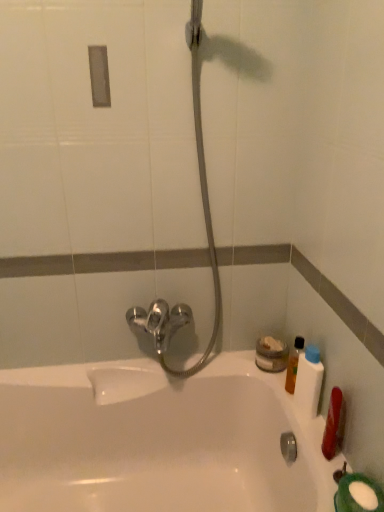
Where is `translucent plastic bottle at right, which appears as the 1th mouthwash when viewed from the back`? Image resolution: width=384 pixels, height=512 pixels. translucent plastic bottle at right, which appears as the 1th mouthwash when viewed from the back is located at coordinates (293, 364).

At what (x,y) coordinates should I click in order to perform the action: click on translucent plastic bottle at right, marked as the 2th mouthwash in a front-to-back arrangement. Please return your answer as a coordinate pair (x, y). The image size is (384, 512). Looking at the image, I should click on (293, 364).

How far apart are translucent plastic bottle at right, marked as the 2th mouthwash in a front-to-back arrangement, and white plastic bottle at right, the second mouthwash from the back?

They are 3.36 inches apart.

Is translucent plastic bottle at right, which appears as the 1th mouthwash when viewed from the back, closer to the viewer compared to white plastic bottle at right, arranged as the 1th mouthwash when viewed from the front?

That is False.

From the image's perspective, is translucent plastic bottle at right, which appears as the 1th mouthwash when viewed from the back, under white plastic bottle at right, arranged as the 1th mouthwash when viewed from the front?

No.

Which is in front, point (290, 390) or point (316, 399)?

Positioned in front is point (316, 399).

Is the surface of white plastic bottle at right, the second mouthwash from the back, in direct contact with white glossy bathtub at center?

white plastic bottle at right, the second mouthwash from the back, and white glossy bathtub at center are clearly separated.

Where is `bathtub located on the left of white plastic bottle at right, arranged as the 1th mouthwash when viewed from the front`? This screenshot has height=512, width=384. bathtub located on the left of white plastic bottle at right, arranged as the 1th mouthwash when viewed from the front is located at coordinates (157, 440).

Which of these two, white plastic bottle at right, arranged as the 1th mouthwash when viewed from the front, or white glossy bathtub at center, is wider?

white glossy bathtub at center.

Is white plastic bottle at right, arranged as the 1th mouthwash when viewed from the front, closer to the viewer compared to white glossy bathtub at center?

That is False.

Is white glossy bathtub at center not inside white plastic bottle at right, the second mouthwash from the back?

Yes, white glossy bathtub at center is not within white plastic bottle at right, the second mouthwash from the back.

From the image's perspective, which object appears higher, white glossy bathtub at center or white plastic bottle at right, arranged as the 1th mouthwash when viewed from the front?

white plastic bottle at right, arranged as the 1th mouthwash when viewed from the front, appears higher in the image.

Is point (73, 505) closer or farther from the camera than point (314, 412)?

Point (73, 505).

Which object is closer to the camera, white glossy bathtub at center or white plastic bottle at right, the second mouthwash from the back?

white glossy bathtub at center is more forward.

Find the location of a particular element. shower located above the white plastic bottle at right, the second mouthwash from the back (from a real-world perspective) is located at coordinates (206, 232).

Does white plastic bottle at right, the second mouthwash from the back, appear on the right side of satin nickel faucet at center?

Yes, white plastic bottle at right, the second mouthwash from the back, is to the right of satin nickel faucet at center.

Does white plastic bottle at right, the second mouthwash from the back, have a greater width compared to satin nickel faucet at center?

Incorrect, the width of white plastic bottle at right, the second mouthwash from the back, does not surpass that of satin nickel faucet at center.

From the image's perspective, is white plastic bottle at right, arranged as the 1th mouthwash when viewed from the front, below satin nickel faucet at center?

Indeed, from the image's perspective, white plastic bottle at right, arranged as the 1th mouthwash when viewed from the front, is shown beneath satin nickel faucet at center.

From a real-world perspective, does translucent plastic bottle at right, which appears as the 1th mouthwash when viewed from the back, stand above satin nickel faucet at center?

No.

Based on their positions, is translucent plastic bottle at right, marked as the 2th mouthwash in a front-to-back arrangement, located to the left or right of satin nickel faucet at center?

From the image, it's evident that translucent plastic bottle at right, marked as the 2th mouthwash in a front-to-back arrangement, is to the right of satin nickel faucet at center.

Is translucent plastic bottle at right, which appears as the 1th mouthwash when viewed from the back, placed right next to satin nickel faucet at center?

No, translucent plastic bottle at right, which appears as the 1th mouthwash when viewed from the back, is not beside satin nickel faucet at center.

From the image's perspective, which is below, translucent plastic bottle at right, marked as the 2th mouthwash in a front-to-back arrangement, or satin nickel faucet at center?

From the image's view, translucent plastic bottle at right, marked as the 2th mouthwash in a front-to-back arrangement, is below.

Between satin nickel faucet at center and white plastic bottle at right, arranged as the 1th mouthwash when viewed from the front, which one appears on the right side from the viewer's perspective?

From the viewer's perspective, white plastic bottle at right, arranged as the 1th mouthwash when viewed from the front, appears more on the right side.

Which of these two, satin nickel faucet at center or white plastic bottle at right, the second mouthwash from the back, is smaller?

white plastic bottle at right, the second mouthwash from the back.

From a real-world perspective, relative to white glossy bathtub at center, is translucent plastic bottle at right, which appears as the 1th mouthwash when viewed from the back, vertically above or below?

Clearly, from a real-world perspective, translucent plastic bottle at right, which appears as the 1th mouthwash when viewed from the back, is above white glossy bathtub at center.

Considering the sizes of translucent plastic bottle at right, which appears as the 1th mouthwash when viewed from the back, and white glossy bathtub at center in the image, is translucent plastic bottle at right, which appears as the 1th mouthwash when viewed from the back, wider or thinner than white glossy bathtub at center?

In the image, translucent plastic bottle at right, which appears as the 1th mouthwash when viewed from the back, appears to be more narrow than white glossy bathtub at center.

In terms of height, does translucent plastic bottle at right, which appears as the 1th mouthwash when viewed from the back, look taller or shorter compared to white glossy bathtub at center?

In the image, translucent plastic bottle at right, which appears as the 1th mouthwash when viewed from the back, appears to be shorter than white glossy bathtub at center.

Based on the photo, which is in front, translucent plastic bottle at right, marked as the 2th mouthwash in a front-to-back arrangement, or white glossy bathtub at center?

white glossy bathtub at center is closer to the camera.

The width and height of the screenshot is (384, 512). In the image, there is a white plastic bottle at right, the second mouthwash from the back. What are the coordinates of `mouthwash below it (from a real-world perspective)` in the screenshot? It's located at (293, 364).

The width and height of the screenshot is (384, 512). Find the location of `the 2nd mouthwash counting from the right of the white glossy bathtub at center`. the 2nd mouthwash counting from the right of the white glossy bathtub at center is located at coordinates (309, 381).

Looking at the image, which one is located further to translucent plastic bottle at right, which appears as the 1th mouthwash when viewed from the back, white glossy bathtub at center or white plastic bottle at right, arranged as the 1th mouthwash when viewed from the front?

Based on the image, white glossy bathtub at center appears to be further to translucent plastic bottle at right, which appears as the 1th mouthwash when viewed from the back.

Estimate the real-world distances between objects in this image. Which object is closer to white plastic bottle at right, the second mouthwash from the back, satin nickel faucet at center or white glossy bathtub at center?

satin nickel faucet at center lies closer to white plastic bottle at right, the second mouthwash from the back, than the other object.

When comparing their distances from white plastic bottle at right, the second mouthwash from the back, does satin nickel faucet at center or translucent plastic bottle at right, marked as the 2th mouthwash in a front-to-back arrangement, seem closer?

translucent plastic bottle at right, marked as the 2th mouthwash in a front-to-back arrangement, is positioned closer to the anchor white plastic bottle at right, the second mouthwash from the back.

When comparing their distances from satin nickel faucet at center, does white glossy bathtub at center or white plastic bottle at right, the second mouthwash from the back, seem closer?

Among the two, white glossy bathtub at center is located nearer to satin nickel faucet at center.

Looking at the image, which one is located further to white glossy bathtub at center, satin nickel faucet at center or white plastic bottle at right, the second mouthwash from the back?

white plastic bottle at right, the second mouthwash from the back, is positioned further to the anchor white glossy bathtub at center.

Which object lies nearer to the anchor point white glossy bathtub at center, white plastic bottle at right, the second mouthwash from the back, or satin nickel faucet at center?

satin nickel faucet at center is closer to white glossy bathtub at center.

Looking at the image, which one is located closer to satin nickel faucet at center, translucent plastic bottle at right, which appears as the 1th mouthwash when viewed from the back, or white glossy bathtub at center?

white glossy bathtub at center lies closer to satin nickel faucet at center than the other object.

Estimate the real-world distances between objects in this image. Which object is further from satin nickel faucet at center, translucent plastic bottle at right, marked as the 2th mouthwash in a front-to-back arrangement, or white plastic bottle at right, the second mouthwash from the back?

white plastic bottle at right, the second mouthwash from the back, is further to satin nickel faucet at center.

This screenshot has width=384, height=512. Identify the location of mouthwash that lies between satin nickel faucet at center and white plastic bottle at right, arranged as the 1th mouthwash when viewed from the front, from top to bottom. (293, 364).

Identify the location of mouthwash between white glossy bathtub at center and white plastic bottle at right, arranged as the 1th mouthwash when viewed from the front. (293, 364).